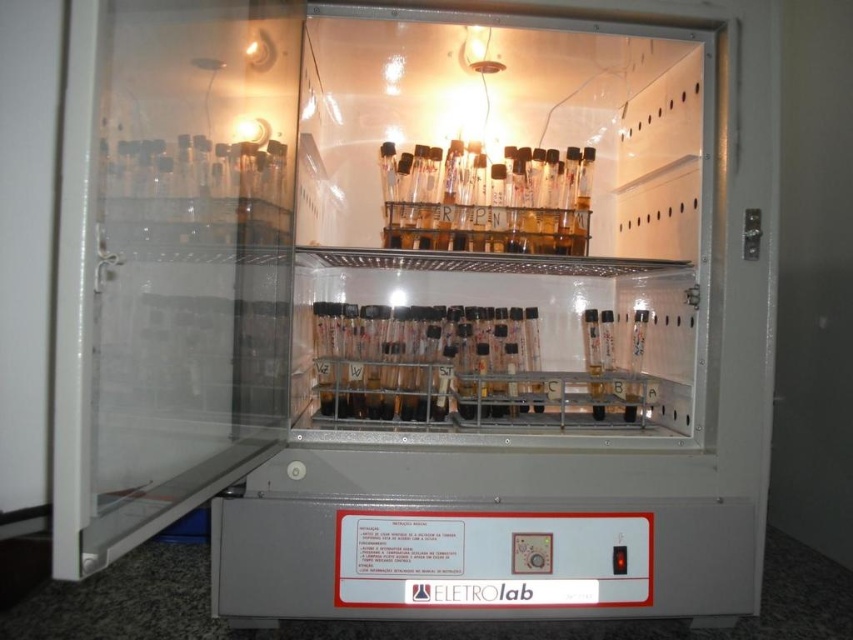
You are a researcher standing 6 feet away from the laboratory incubator. You need to reach the clear plastic tubes at center inside the incubator. Can you comfortably reach them without moving closer?

The clear plastic tubes at center are 4.46 feet away from the viewer. Since you are standing 6 feet away from the incubator, the total distance would be more than 6 feet, so you cannot comfortably reach them without moving closer.

You are standing in front of the laboratory incubator with its door open. You need to reach a point located at coordinates point [341,340] inside the incubator. If your arm can extend 4 feet, can you reach that point without opening the door further?

The point [341,340] is 4.79 feet away from the camera, which is beyond your arm reach of 4 feet. Therefore, you cannot reach it without opening the door further.